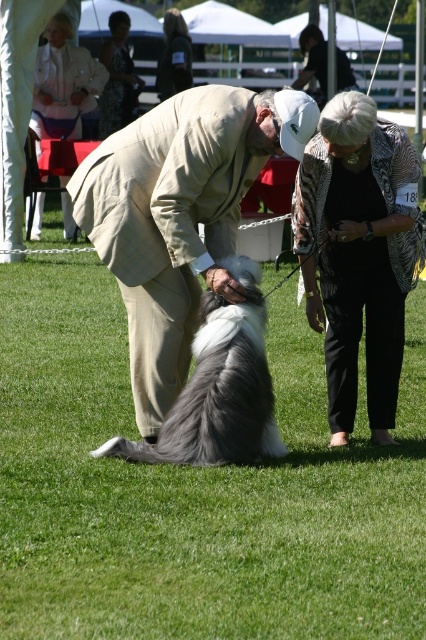
Question: Can you confirm if beige wool suit at center is smaller than khaki suit at center?

Choices:
 (A) yes
 (B) no

Answer: (A)

Question: Which object is positioned farthest from the smooth black jacket at upper center?

Choices:
 (A) gray woolen dog at center
 (B) khaki suit at center
 (C) printed cotton dress at upper center

Answer: (A)

Question: Is gray woolen dog at center below smooth black jacket at upper center?

Choices:
 (A) no
 (B) yes

Answer: (B)

Question: Which point is farther to the camera?

Choices:
 (A) printed cotton dress at upper center
 (B) khaki suit at center

Answer: (B)

Question: Estimate the real-world distances between objects in this image. Which object is closer to the printed cotton dress at upper center?

Choices:
 (A) gray woolen dog at center
 (B) beige wool suit at center
 (C) black textured jacket at center
 (D) khaki suit at center

Answer: (D)

Question: Is printed cotton dress at upper center to the left of smooth black jacket at upper center from the viewer's perspective?

Choices:
 (A) yes
 (B) no

Answer: (A)